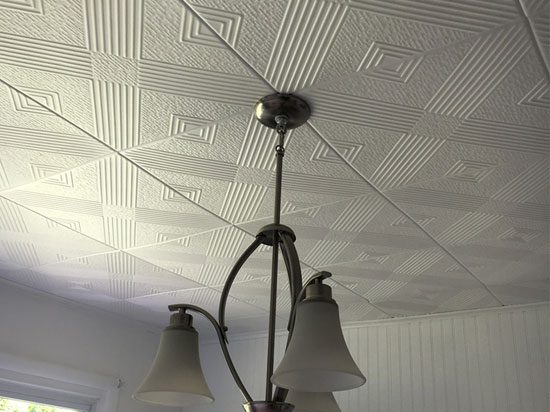
Find the location of a particular element. The width and height of the screenshot is (550, 412). wall is located at coordinates (508, 371), (123, 350).